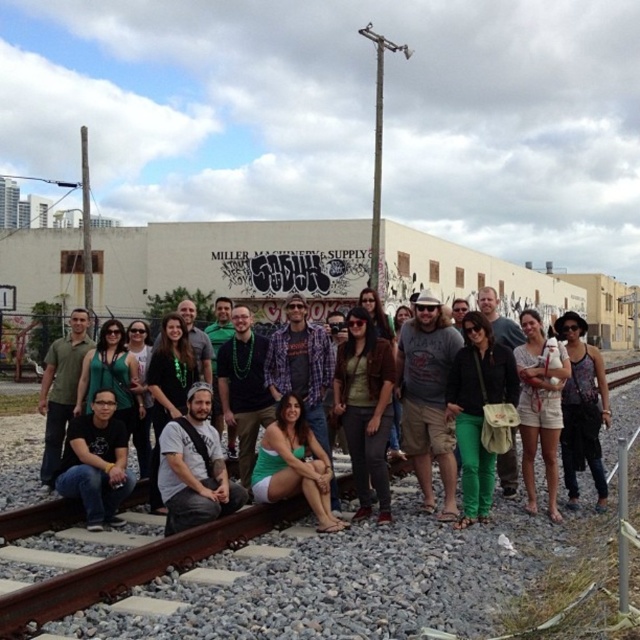
You are a photographer trying to capture a clear shot of the green matte shirt at center. However, the black matte shirt at lower left is blocking your view. Can you adjust your position to avoid the obstruction?

The black matte shirt at lower left is in front of the green matte shirt at center, so moving your position behind or to the side of the black matte shirt at lower left would allow you to see the green matte shirt at center without obstruction.